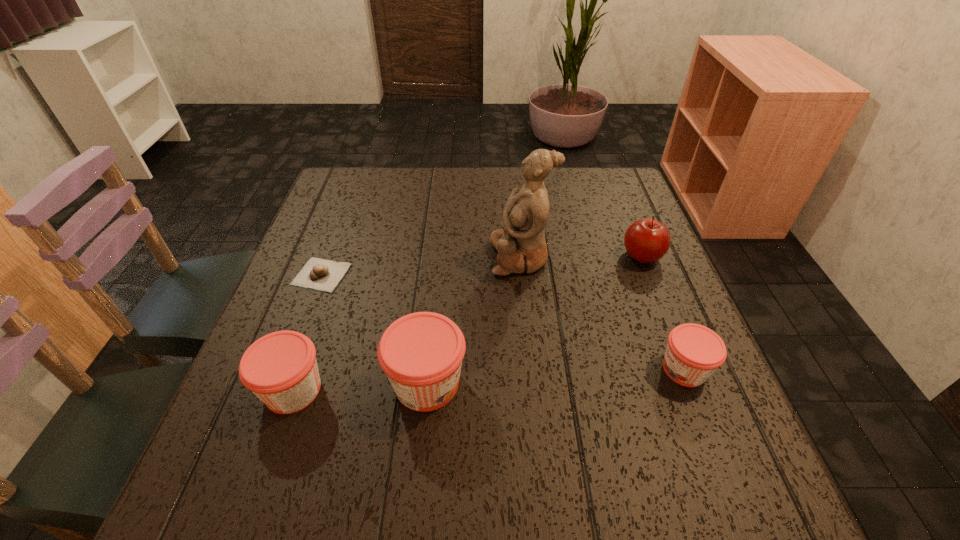
At what (x,y) coordinates should I click in order to perform the action: click on the leftmost jam. Please return your answer as a coordinate pair (x, y). The image size is (960, 540). Looking at the image, I should click on (280, 368).

This screenshot has height=540, width=960. I want to click on the fourth object from right to left, so click(421, 353).

You are a GUI agent. You are given a task and a screenshot of the screen. Output one action in this format:
    pyautogui.click(x=<x>, y=<y>)
    Task: Click on the tallest jam
    The image size is (960, 540).
    Given the screenshot: What is the action you would take?
    pyautogui.click(x=421, y=353)

In order to click on the shortest jam in this screenshot , I will do `click(694, 352)`.

Where is `the fifth tallest object`? The height and width of the screenshot is (540, 960). the fifth tallest object is located at coordinates (694, 352).

Where is `apple`? Image resolution: width=960 pixels, height=540 pixels. apple is located at coordinates (646, 240).

At what (x,y) coordinates should I click in order to perform the action: click on the shortest object. Please return your answer as a coordinate pair (x, y). Image resolution: width=960 pixels, height=540 pixels. Looking at the image, I should click on (317, 274).

You are a GUI agent. You are given a task and a screenshot of the screen. Output one action in this format:
    pyautogui.click(x=<x>, y=<y>)
    Task: Click on the tallest object
    The height and width of the screenshot is (540, 960).
    Given the screenshot: What is the action you would take?
    pyautogui.click(x=521, y=245)

Locate an element on the screen. The height and width of the screenshot is (540, 960). the fourth object from left to right is located at coordinates (521, 245).

Where is `vacant space located 0.350m on the front label of the fourth object from right to left`? vacant space located 0.350m on the front label of the fourth object from right to left is located at coordinates (655, 383).